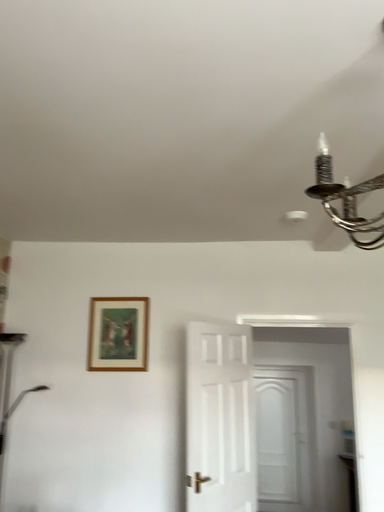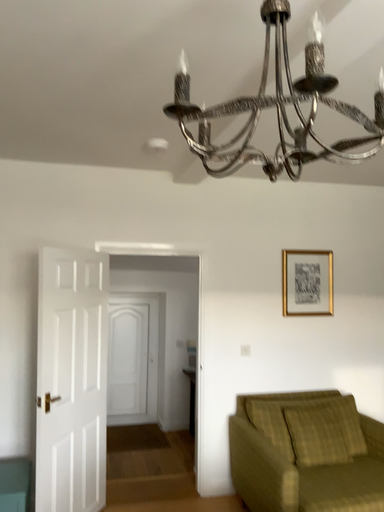
Question: How did the camera likely rotate when shooting the video?

Choices:
 (A) rotated downward
 (B) rotated upward

Answer: (A)